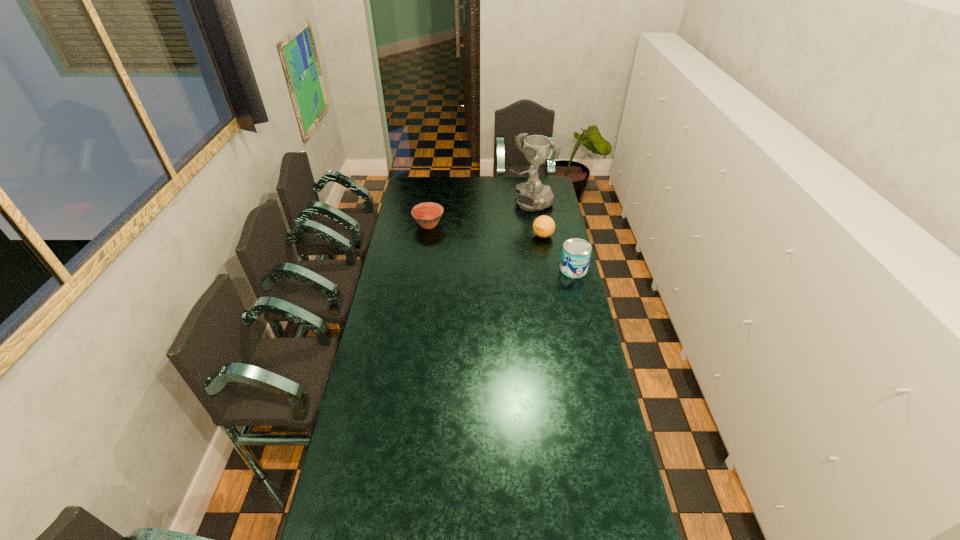
The image size is (960, 540). What are the coordinates of `vacant space on the desktop that is between the leftmost object and the second tallest object and is positioned on the side with emblem of the farthest object` in the screenshot? It's located at (487, 242).

Image resolution: width=960 pixels, height=540 pixels. In order to click on vacant space on the desktop that is between the shortest object and the nearest object and is positioned on the side with brand of the ping-pong ball in this screenshot , I will do `click(512, 251)`.